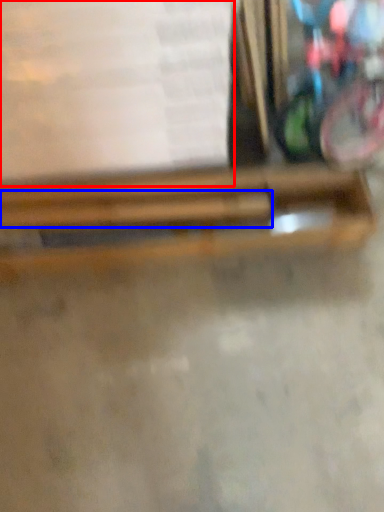
Question: Which object appears farthest to the camera in this image, paperback book (highlighted by a red box) or wood (highlighted by a blue box)?

Choices:
 (A) paperback book
 (B) wood

Answer: (B)